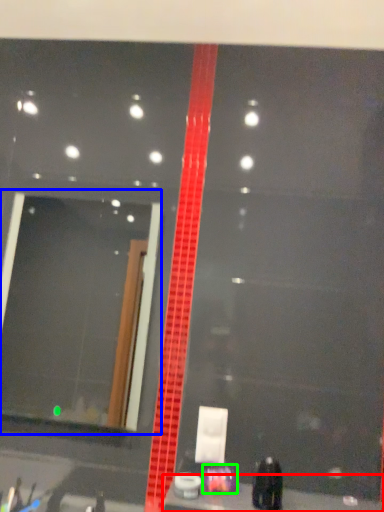
Question: Considering the real-world distances, which object is closest to counter top (highlighted by a red box)? mirror (highlighted by a blue box) or toiletry (highlighted by a green box).

Choices:
 (A) mirror
 (B) toiletry

Answer: (B)